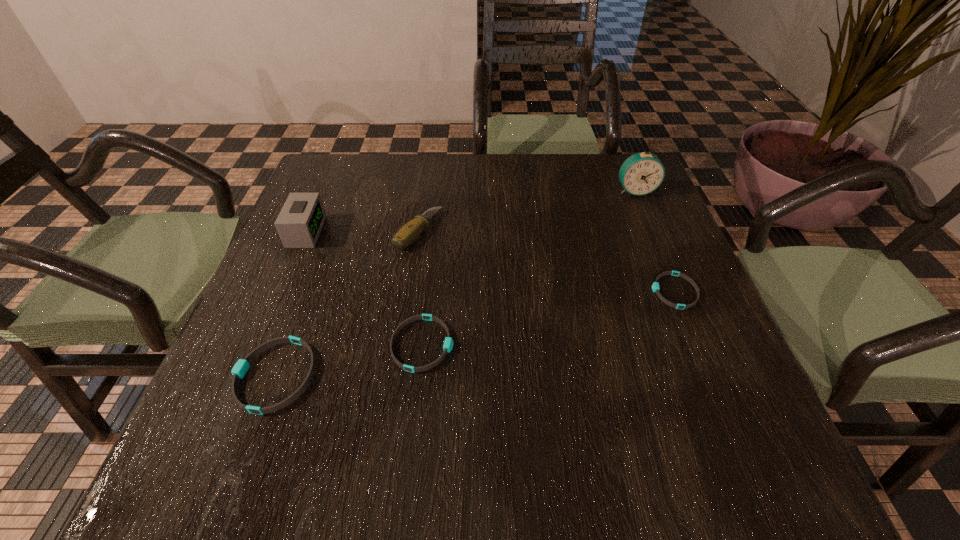
The width and height of the screenshot is (960, 540). I want to click on the leftmost wristband, so click(239, 370).

Identify the location of the tallest wristband. (239, 370).

You are a GUI agent. You are given a task and a screenshot of the screen. Output one action in this format:
    pyautogui.click(x=<x>, y=<y>)
    Task: Click on the second shortest wristband
    This screenshot has width=960, height=540.
    Given the screenshot: What is the action you would take?
    pyautogui.click(x=448, y=343)

In order to click on the fifth tallest object in this screenshot , I will do `click(448, 343)`.

You are a GUI agent. You are given a task and a screenshot of the screen. Output one action in this format:
    pyautogui.click(x=<x>, y=<y>)
    Task: Click on the rightmost wristband
    
    Given the screenshot: What is the action you would take?
    (655, 286)

This screenshot has width=960, height=540. What are the coordinates of `the farthest wristband` in the screenshot? It's located at (655, 286).

Find the location of a particular element. This screenshot has height=540, width=960. the second tallest object is located at coordinates (299, 223).

Image resolution: width=960 pixels, height=540 pixels. What are the coordinates of `the shorter alarm clock` in the screenshot? It's located at (299, 223).

This screenshot has width=960, height=540. Identify the location of the tallest object. (642, 173).

In order to click on the farthest object in this screenshot , I will do `click(642, 173)`.